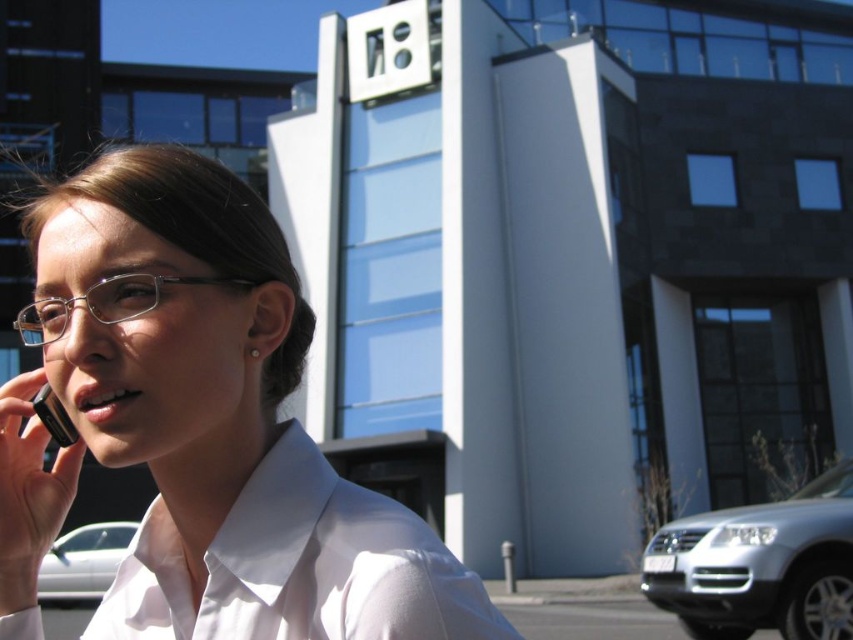
What are the coordinates of the white smooth shirt at center in the image?

The coordinates of the white smooth shirt at center are at point (299,566).

You are a photographer trying to capture a clear shot of the white smooth shirt at center and the black glossy smartphone at left. Since you want both items to be in focus, which one should you adjust your camera focus on first?

The white smooth shirt at center is closer to the viewer than the black glossy smartphone at left, so you should focus on the white smooth shirt at center first to ensure both are in focus.

You are standing in front of the modern building with the large sign. You notice a specific point at coordinates [202,428]. What object in the scene is located at this point?

The point at coordinates [202,428] corresponds to the white glossy shirt at center.